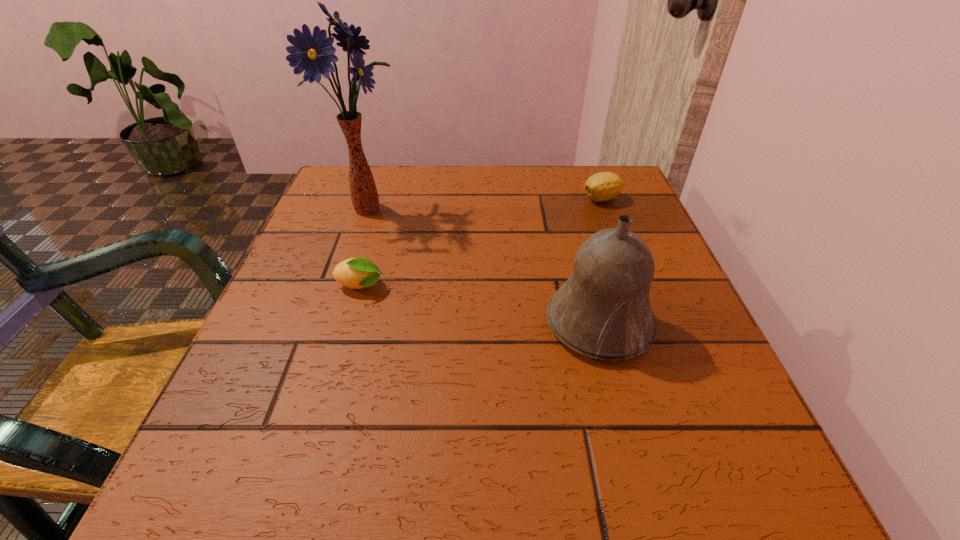
Where is `unoccupied area between the flower arrangement and the second tallest object`? The width and height of the screenshot is (960, 540). unoccupied area between the flower arrangement and the second tallest object is located at coordinates (484, 265).

The width and height of the screenshot is (960, 540). Find the location of `the second closest object relative to the flower arrangement`. the second closest object relative to the flower arrangement is located at coordinates (603, 311).

You are a GUI agent. You are given a task and a screenshot of the screen. Output one action in this format:
    pyautogui.click(x=<x>, y=<y>)
    Task: Click on the object that is the third closest one to the bell
    
    Given the screenshot: What is the action you would take?
    pyautogui.click(x=313, y=53)

This screenshot has width=960, height=540. I want to click on free region that satisfies the following two spatial constraints: 1. with leaves positioned above the left lemon; 2. on the left side of the second tallest object, so click(x=349, y=323).

Find the location of a particular element. The width and height of the screenshot is (960, 540). free location that satisfies the following two spatial constraints: 1. with leaves positioned above the nearer lemon; 2. on the right side of the bell is located at coordinates (349, 323).

Identify the location of free space that satisfies the following two spatial constraints: 1. with leaves positioned above the second tallest object; 2. on the left side of the left lemon. (349, 323).